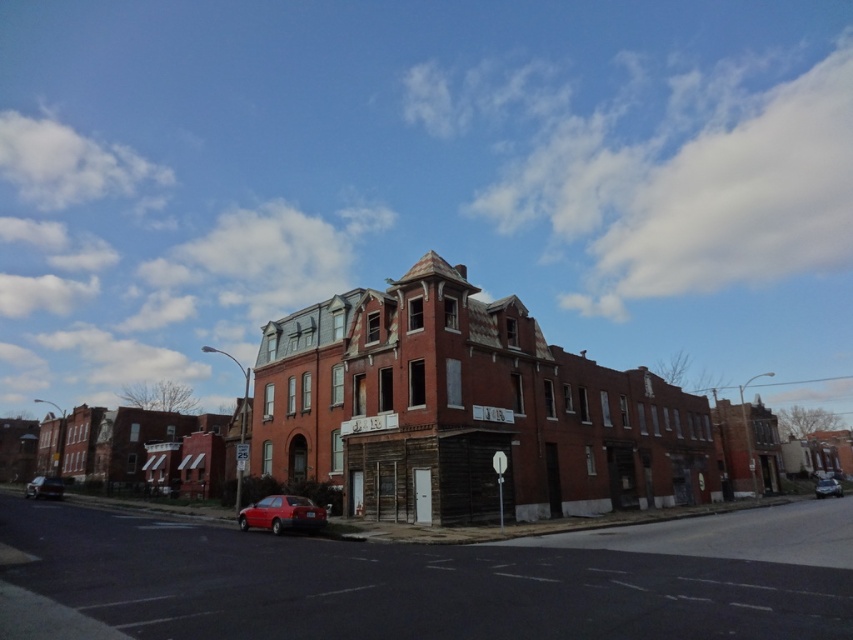
Question: Which of these objects is positioned farthest from the shiny red car at lower left?

Choices:
 (A) shiny red sedan at lower center
 (B) metallic silver sedan at lower right

Answer: (B)

Question: Is shiny red sedan at lower center thinner than metallic silver sedan at lower right?

Choices:
 (A) yes
 (B) no

Answer: (A)

Question: Which object appears farthest from the camera in this image?

Choices:
 (A) shiny red car at lower left
 (B) shiny red sedan at lower center

Answer: (A)

Question: Which point is closer to the camera taking this photo?

Choices:
 (A) (53, 477)
 (B) (242, 515)

Answer: (B)

Question: Is shiny red sedan at lower center further to the viewer compared to shiny red car at lower left?

Choices:
 (A) no
 (B) yes

Answer: (A)

Question: Considering the relative positions of shiny red sedan at lower center and shiny red car at lower left in the image provided, where is shiny red sedan at lower center located with respect to shiny red car at lower left?

Choices:
 (A) left
 (B) right

Answer: (B)